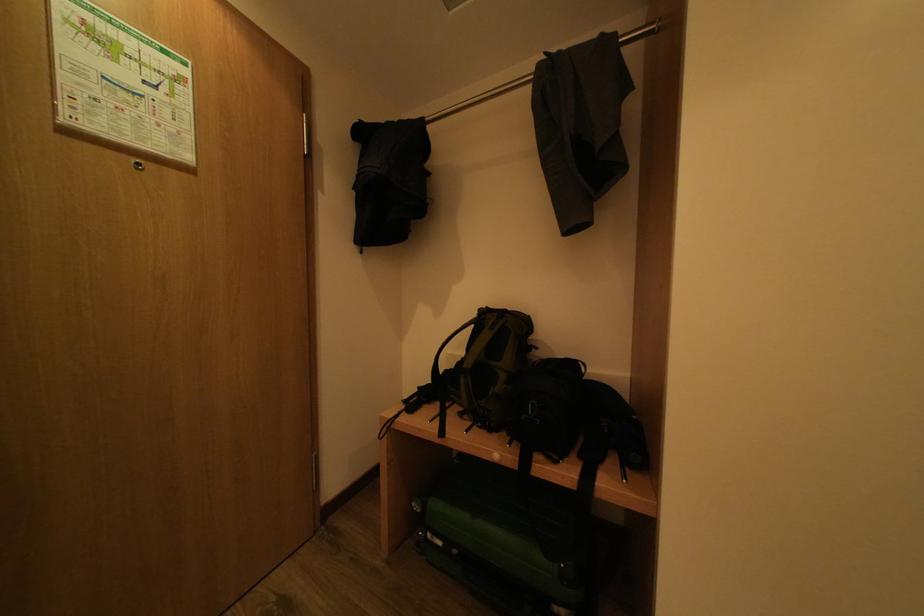
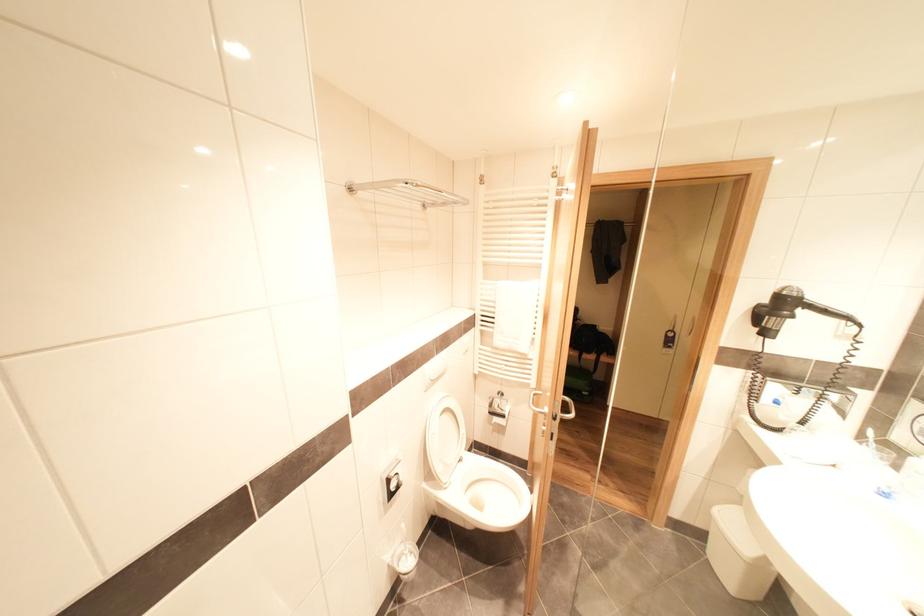
The images are taken continuously from a first-person perspective. In which direction are you moving?

The cameraman moved toward left, backward.